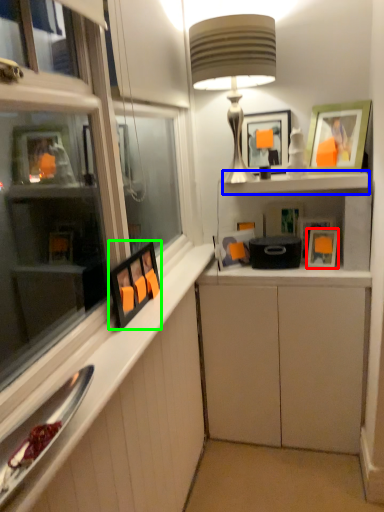
Question: Estimate the real-world distances between objects in this image. Which object is farther from picture frame (highlighted by a red box), cabinet (highlighted by a blue box) or picture frame (highlighted by a green box)?

Choices:
 (A) cabinet
 (B) picture frame

Answer: (B)